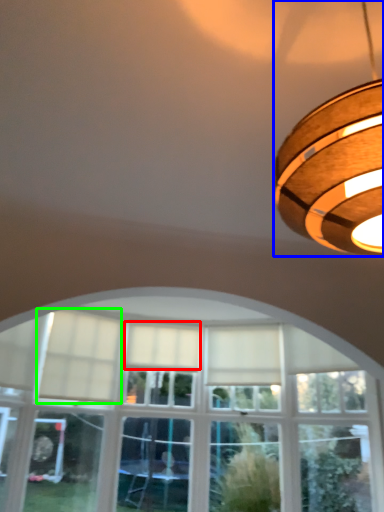
Question: Based on their relative distances, which object is nearer to curtain (highlighted by a red box)? Choose from lamp (highlighted by a blue box) and curtain (highlighted by a green box).

Choices:
 (A) lamp
 (B) curtain

Answer: (B)